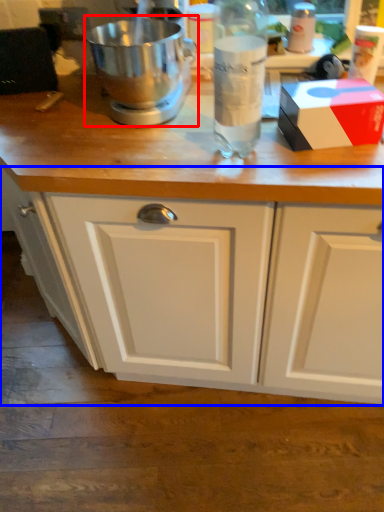
Question: Which object appears closest to the camera in this image, mixer (highlighted by a red box) or cabinetry (highlighted by a blue box)?

Choices:
 (A) mixer
 (B) cabinetry

Answer: (A)